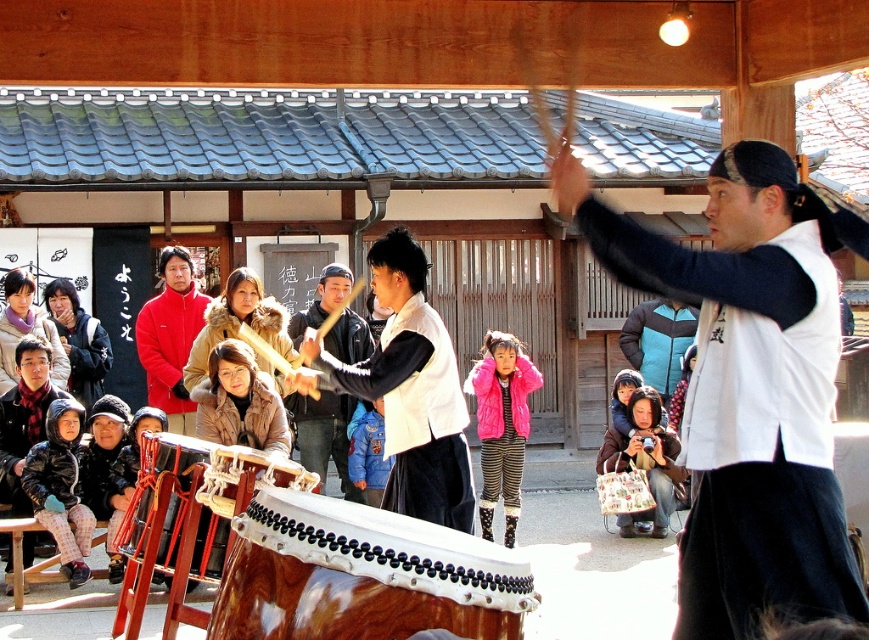
You are a photographer at the event and want to capture a photo of the blue denim jacket at center without the wooden drum at center blocking it. What should you do?

The wooden drum at center is in front of the blue denim jacket at center, so you should move your camera position to the side to avoid the drum blocking the jacket.

You are a photographer trying to capture a photo of the fluffy pink coat at lower center without including the red fleece jacket at upper left in the frame. Based on their positions, is this possible?

The red fleece jacket at upper left is positioned on the left side of the fluffy pink coat at lower center, so the photographer can adjust the camera angle to exclude the red fleece jacket at upper left while focusing on the fluffy pink coat at lower center.

You are a spectator standing at the back of the crowd. You want to take a photo of both the shiny brown drum at center and the wooden drum at lower left. Which drum should you focus on first to ensure both are in frame?

You should focus on the wooden drum at lower left first since it is taller than the shiny brown drum at center, making it easier to frame both in the photo.